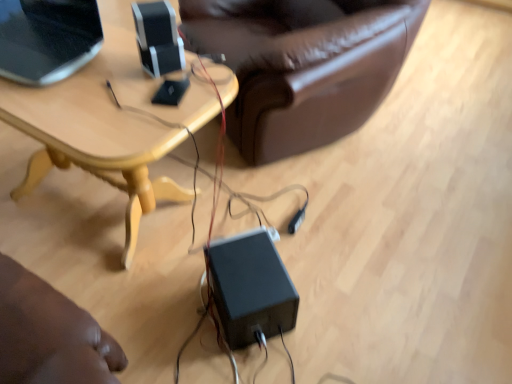
Question: Considering the relative sizes of black matte speaker at upper center, which is the 2th speaker from bottom to top, and matte black laptop at upper left in the image provided, is black matte speaker at upper center, which is the 2th speaker from bottom to top, wider than matte black laptop at upper left?

Choices:
 (A) yes
 (B) no

Answer: (B)

Question: Does black matte speaker at upper center, placed as the 1th speaker when sorted from left to right, appear on the right side of matte black laptop at upper left?

Choices:
 (A) yes
 (B) no

Answer: (A)

Question: Does black matte speaker at upper center, marked as the 1th speaker in a top-to-bottom arrangement, come behind matte black laptop at upper left?

Choices:
 (A) yes
 (B) no

Answer: (A)

Question: Considering the relative positions of black matte speaker at upper center, which is the 2th speaker from bottom to top, and matte black laptop at upper left in the image provided, is black matte speaker at upper center, which is the 2th speaker from bottom to top, in front of matte black laptop at upper left?

Choices:
 (A) no
 (B) yes

Answer: (A)

Question: Does black matte speaker at upper center, placed as the 1th speaker when sorted from left to right, contain matte black laptop at upper left?

Choices:
 (A) no
 (B) yes

Answer: (A)

Question: Considering their positions, is black plastic power supply at center, which is the first speaker from bottom to top, located in front of or behind matte black laptop at upper left?

Choices:
 (A) behind
 (B) front

Answer: (A)

Question: Looking at their shapes, would you say black plastic power supply at center, the first speaker from the right, is wider or thinner than matte black laptop at upper left?

Choices:
 (A) wide
 (B) thin

Answer: (B)

Question: From the image's perspective, is black plastic power supply at center, which is the first speaker from bottom to top, above or below matte black laptop at upper left?

Choices:
 (A) below
 (B) above

Answer: (A)

Question: Based on their positions, is black plastic power supply at center, the first speaker from the right, located to the left or right of matte black laptop at upper left?

Choices:
 (A) left
 (B) right

Answer: (B)

Question: Is black plastic power supply at center, the second speaker viewed from the left, spatially inside black matte speaker at upper center, which ranks as the 2th speaker in right-to-left order, or outside of it?

Choices:
 (A) outside
 (B) inside

Answer: (A)

Question: From a real-world perspective, is black plastic power supply at center, the second speaker viewed from the left, positioned above or below black matte speaker at upper center, which ranks as the 2th speaker in right-to-left order?

Choices:
 (A) above
 (B) below

Answer: (B)

Question: Does point (237, 296) appear closer or farther from the camera than point (146, 49)?

Choices:
 (A) closer
 (B) farther

Answer: (B)

Question: From the image's perspective, is black plastic power supply at center, which is the first speaker from bottom to top, positioned above or below black matte speaker at upper center, placed as the 1th speaker when sorted from left to right?

Choices:
 (A) above
 (B) below

Answer: (B)

Question: Choose the correct answer: Is black matte speaker at upper center, which ranks as the 2th speaker in right-to-left order, inside matte black laptop at upper left or outside it?

Choices:
 (A) inside
 (B) outside

Answer: (B)

Question: In terms of height, does black matte speaker at upper center, which is the 2th speaker from bottom to top, look taller or shorter compared to matte black laptop at upper left?

Choices:
 (A) short
 (B) tall

Answer: (A)